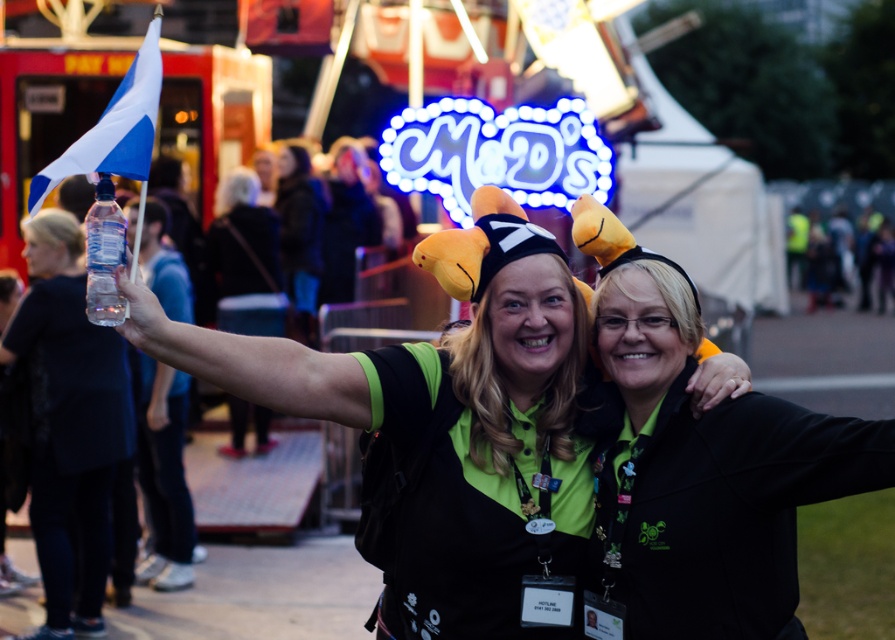
Which is more to the right, black matte hat at center or clear plastic bottle at upper left?

black matte hat at center is more to the right.

What do you see at coordinates (526, 342) in the screenshot?
I see `black matte hat at center` at bounding box center [526, 342].

Measure the distance between black matte hat at center and camera.

black matte hat at center and camera are 19.91 meters apart.

Identify the location of black matte hat at center. This screenshot has width=895, height=640. (526, 342).